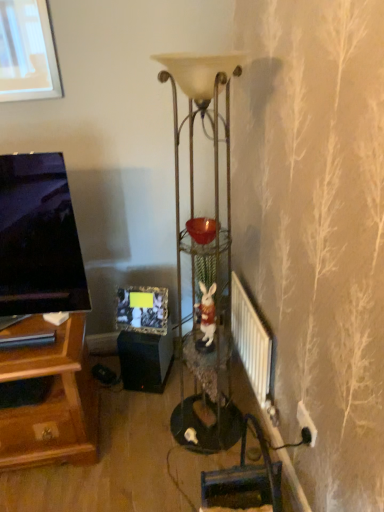
This screenshot has width=384, height=512. I want to click on vacant area located to the right-hand side of black matte speaker at lower center, so click(178, 377).